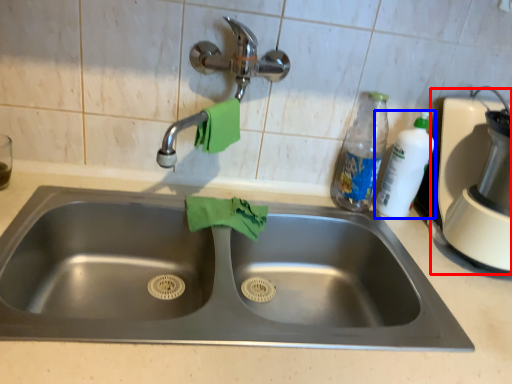
Question: Which of the following is the closest to the observer, blender (highlighted by a red box) or cleaning product (highlighted by a blue box)?

Choices:
 (A) blender
 (B) cleaning product

Answer: (A)